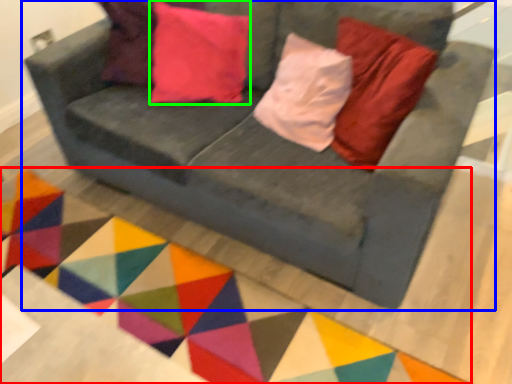
Question: Which object is the farthest from mat (highlighted by a red box)? Choose among these: studio couch (highlighted by a blue box) or pillow (highlighted by a green box).

Choices:
 (A) studio couch
 (B) pillow

Answer: (B)